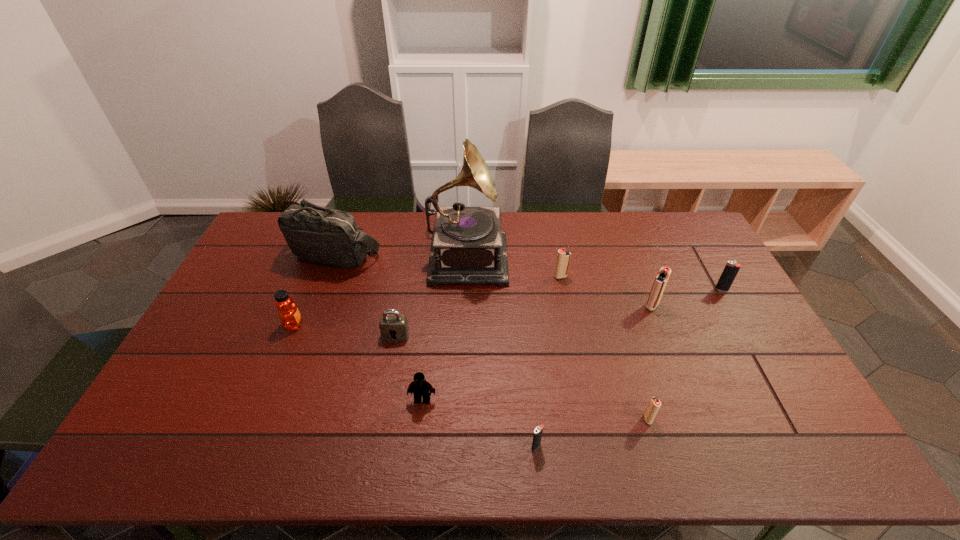
You are a GUI agent. You are given a task and a screenshot of the screen. Output one action in this format:
    pyautogui.click(x=<x>, y=<y>)
    Task: Click on the record player
    The width and height of the screenshot is (960, 540).
    Given the screenshot: What is the action you would take?
    pyautogui.click(x=468, y=246)

Identify the location of golden record player. Image resolution: width=960 pixels, height=540 pixels. (468, 246).

Locate an element on the screen. the second tallest object is located at coordinates (319, 235).

Identify the location of the tallest igniter. (661, 279).

Where is `the second nearest red igniter`? the second nearest red igniter is located at coordinates (661, 279).

Identify the location of honey. pos(288,313).

Locate an element on the screen. The image size is (960, 540). the bigger black igniter is located at coordinates (731, 269).

Find the location of `the fourth nearest igniter`. the fourth nearest igniter is located at coordinates (731, 269).

Where is `the second smallest red igniter`? The width and height of the screenshot is (960, 540). the second smallest red igniter is located at coordinates (563, 257).

The image size is (960, 540). I want to click on the leftmost red igniter, so click(x=563, y=257).